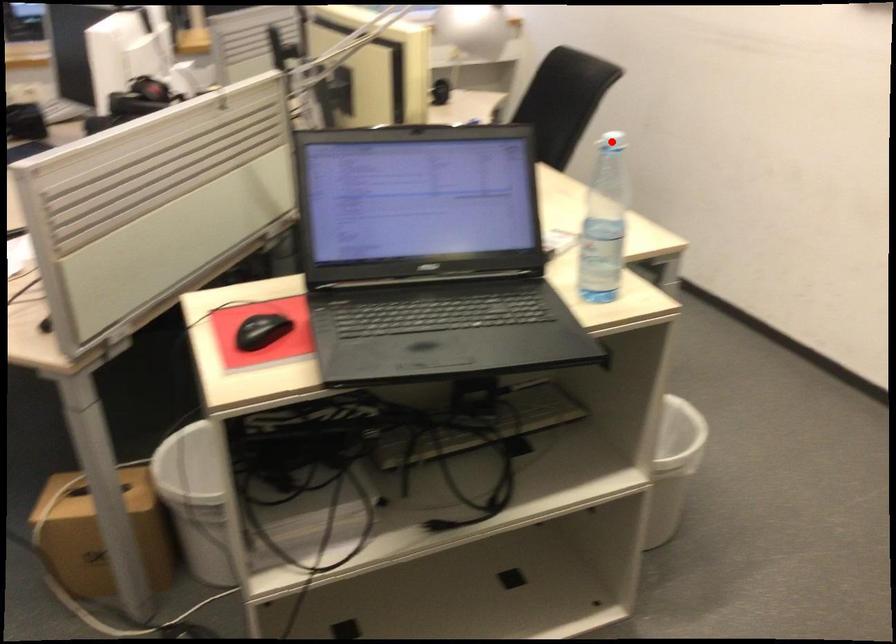
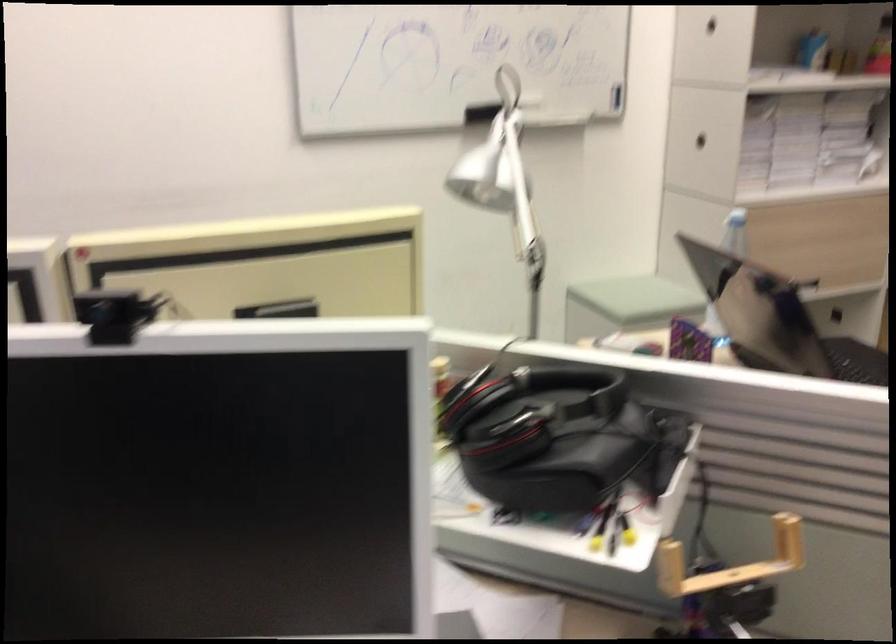
Question: I am providing you with two images of the same scene from different viewpoints. A red point is marked on the first image. At the location where the point appears in image 1, is it still visible in image 2?

Choices:
 (A) Yes
 (B) No

Answer: (B)